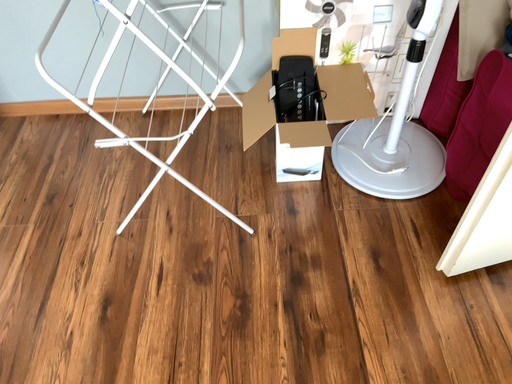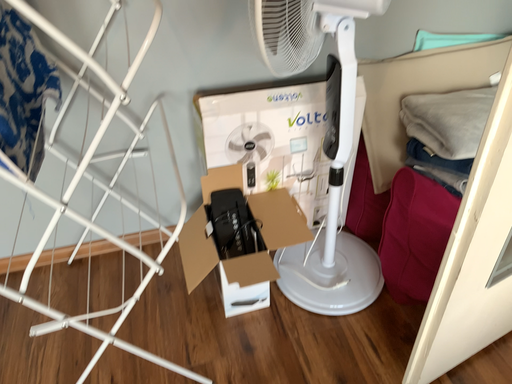
Question: Which way did the camera rotate in the video?

Choices:
 (A) rotated left
 (B) rotated right

Answer: (B)